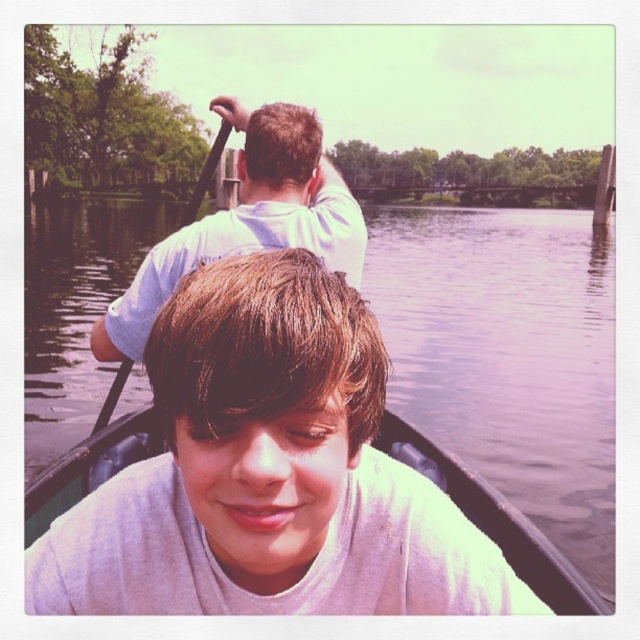
Which is more to the right, smooth white shirt at center or black wood paddle at upper center?

smooth white shirt at center

Between smooth white shirt at center and black wood paddle at upper center, which one is positioned higher?

black wood paddle at upper center is higher up.

Which is in front, point (428, 532) or point (218, 160)?

Point (428, 532) is more forward.

This screenshot has width=640, height=640. Find the location of `smooth white shirt at center`. smooth white shirt at center is located at coordinates (268, 472).

Based on the photo, does smooth white shirt at center have a larger size compared to white cotton shirt at upper center?

Yes, smooth white shirt at center is bigger than white cotton shirt at upper center.

Is smooth white shirt at center to the left of white cotton shirt at upper center from the viewer's perspective?

In fact, smooth white shirt at center is to the right of white cotton shirt at upper center.

The width and height of the screenshot is (640, 640). Find the location of `smooth white shirt at center`. smooth white shirt at center is located at coordinates (268, 472).

Is point (348, 200) farther from camera compared to point (193, 189)?

That is False.

Can you confirm if white cotton shirt at upper center is bigger than black wood paddle at upper center?

No.

Is point (244, 166) in front of point (211, 147)?

Yes, point (244, 166) is in front of point (211, 147).

At what (x,y) coordinates should I click in order to perform the action: click on white cotton shirt at upper center. Please return your answer as a coordinate pair (x, y). Image resolution: width=640 pixels, height=640 pixels. Looking at the image, I should click on (248, 220).